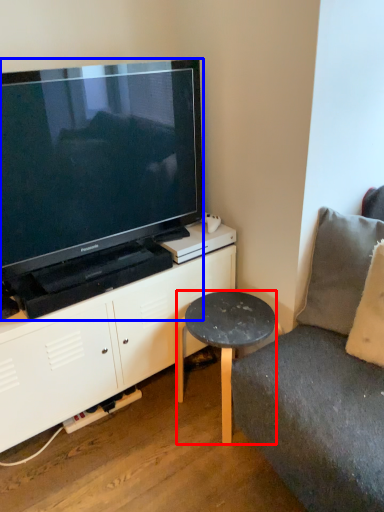
Question: Which of the following is the closest to the observer, table (highlighted by a red box) or television (highlighted by a blue box)?

Choices:
 (A) table
 (B) television

Answer: (B)